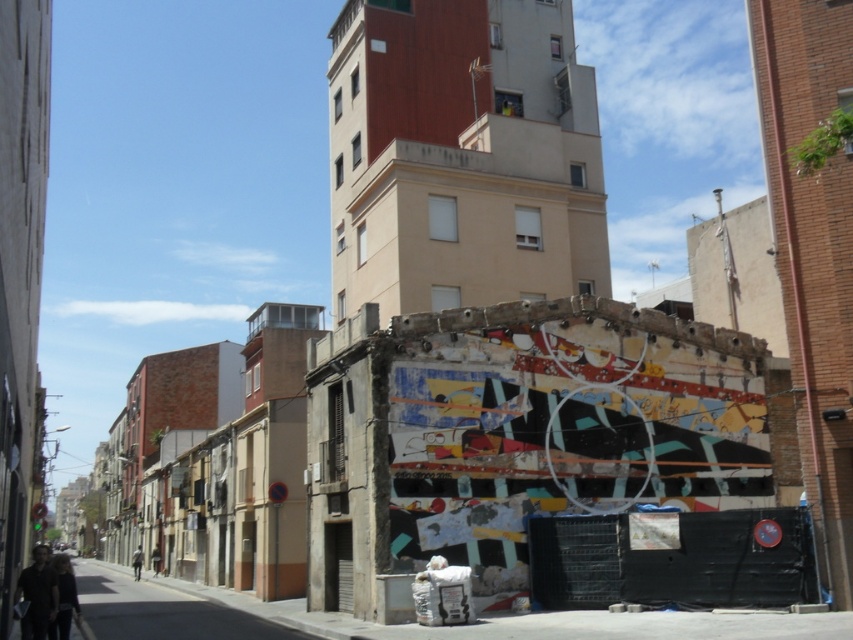
Who is positioned more to the left, smooth concrete building at upper center or dark gray fabric jacket at lower left?

Positioned to the left is dark gray fabric jacket at lower left.

Locate an element on the screen. This screenshot has height=640, width=853. smooth concrete building at upper center is located at coordinates (461, 156).